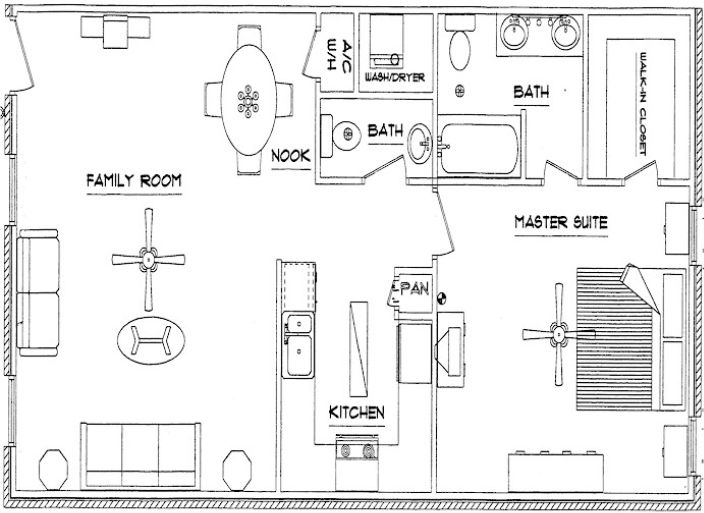
Find the location of a particular element. Image resolution: width=704 pixels, height=513 pixels. couch is located at coordinates (134, 464), (48, 280).